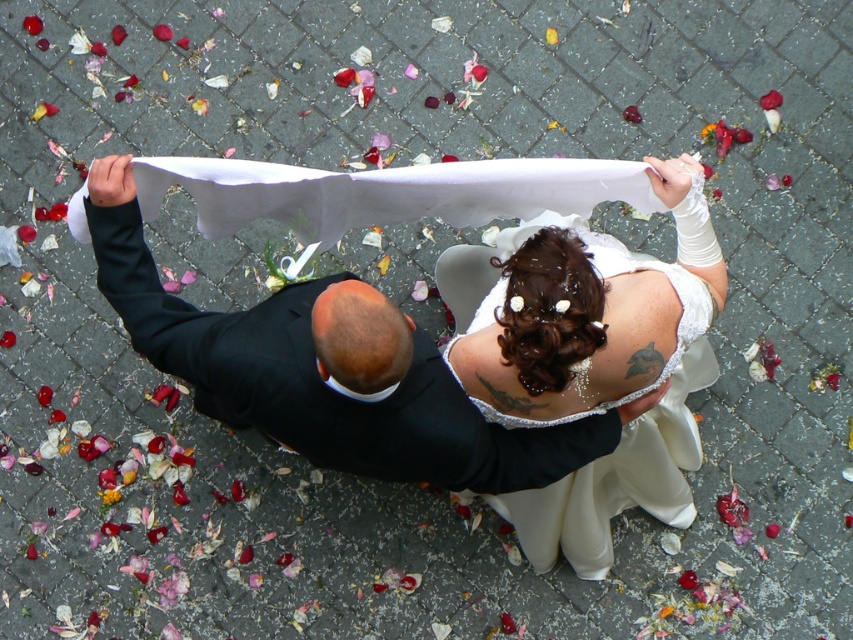
Question: Does white lace dress at center lie behind black satin suit at center?

Choices:
 (A) yes
 (B) no

Answer: (A)

Question: Which of the following is the closest to the observer?

Choices:
 (A) (445, 269)
 (B) (524, 452)

Answer: (B)

Question: Is white lace dress at center to the left of black satin suit at center from the viewer's perspective?

Choices:
 (A) no
 (B) yes

Answer: (A)

Question: Is white lace dress at center smaller than black satin suit at center?

Choices:
 (A) no
 (B) yes

Answer: (B)

Question: Which of the following is the closest to the observer?

Choices:
 (A) (251, 337)
 (B) (676, 419)

Answer: (A)